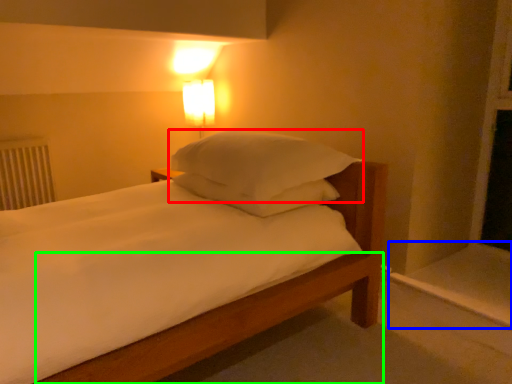
Question: Which is farther away from pillow (highlighted by a red box)? window sill (highlighted by a blue box) or bed frame (highlighted by a green box)?

Choices:
 (A) window sill
 (B) bed frame

Answer: (A)